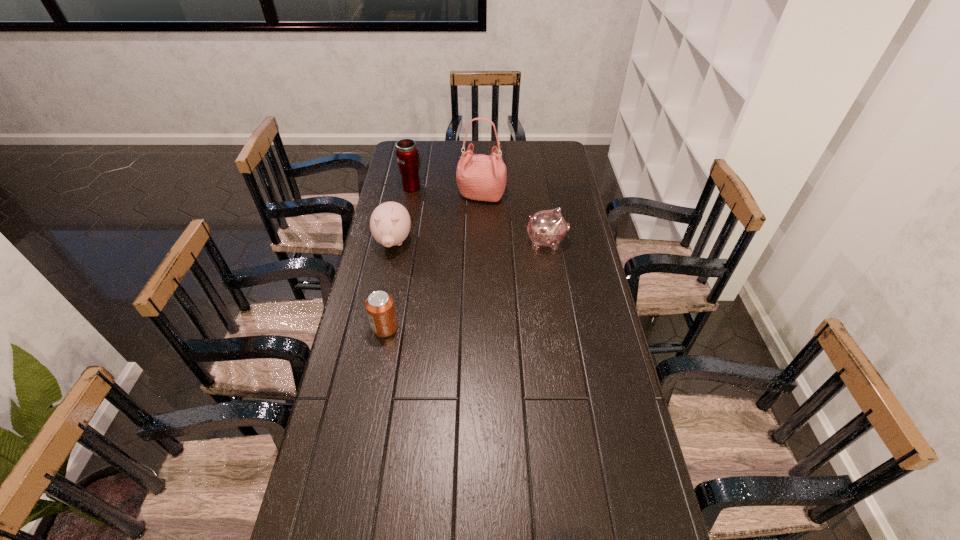
Locate an element on the screen. The width and height of the screenshot is (960, 540). the fourth object from left to right is located at coordinates (479, 177).

Find the location of `handbag`. handbag is located at coordinates (479, 177).

This screenshot has width=960, height=540. I want to click on the second tallest object, so click(409, 159).

Locate an element on the screen. The height and width of the screenshot is (540, 960). the left piggy bank is located at coordinates (390, 223).

The width and height of the screenshot is (960, 540). Find the location of `the right piggy bank`. the right piggy bank is located at coordinates (548, 228).

Where is `the nearest object`? The image size is (960, 540). the nearest object is located at coordinates (380, 307).

Identify the location of free space located on the left of the tallest object. This screenshot has width=960, height=540. (422, 195).

You are a GUI agent. You are given a task and a screenshot of the screen. Output one action in this format:
    pyautogui.click(x=<x>, y=<y>)
    Task: Click on the free space located 0.330m on the side with the handle of the thermos bottle
    
    Given the screenshot: What is the action you would take?
    pyautogui.click(x=420, y=143)

Where is `vacant area situated 0.330m on the side with the handle of the thermos bottle`? vacant area situated 0.330m on the side with the handle of the thermos bottle is located at coordinates (420, 143).

The image size is (960, 540). Find the location of `vacant position located 0.140m on the side with the handle of the thermos bottle`. vacant position located 0.140m on the side with the handle of the thermos bottle is located at coordinates (417, 164).